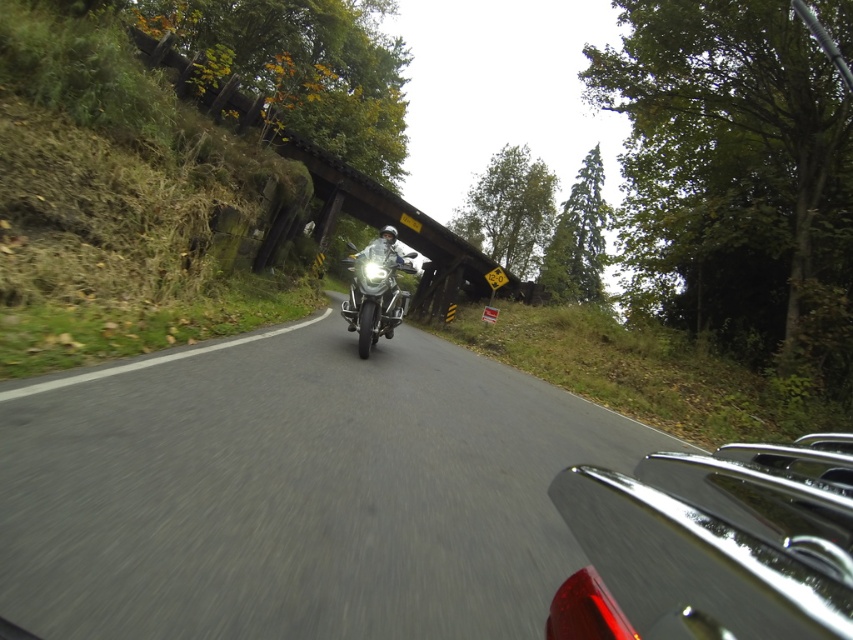
Is black asphalt road at center thinner than wooden bridge at center?

Answer: Yes.

Is black asphalt road at center positioned in front of wooden bridge at center?

Yes, black asphalt road at center is in front of wooden bridge at center.

Identify the location of black asphalt road at center. (294, 490).

Who is positioned more to the left, wooden bridge at center or shiny chrome motorcycle at center?

From the viewer's perspective, wooden bridge at center appears more on the left side.

Does wooden bridge at center appear under shiny chrome motorcycle at center?

Incorrect, wooden bridge at center is not positioned below shiny chrome motorcycle at center.

This screenshot has width=853, height=640. In order to click on wooden bridge at center in this screenshot , I will do `click(392, 220)`.

Who is shorter, black asphalt road at center or shiny chrome motorcycle at center?

shiny chrome motorcycle at center

Where is `black asphalt road at center`? The height and width of the screenshot is (640, 853). black asphalt road at center is located at coordinates (294, 490).